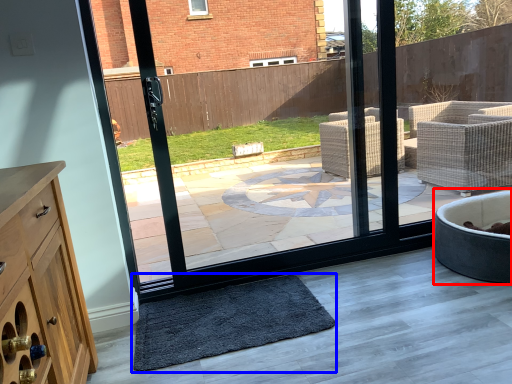
Question: Which point is closer to the camera, bath (highlighted by a red box) or mat (highlighted by a blue box)?

Choices:
 (A) bath
 (B) mat

Answer: (B)